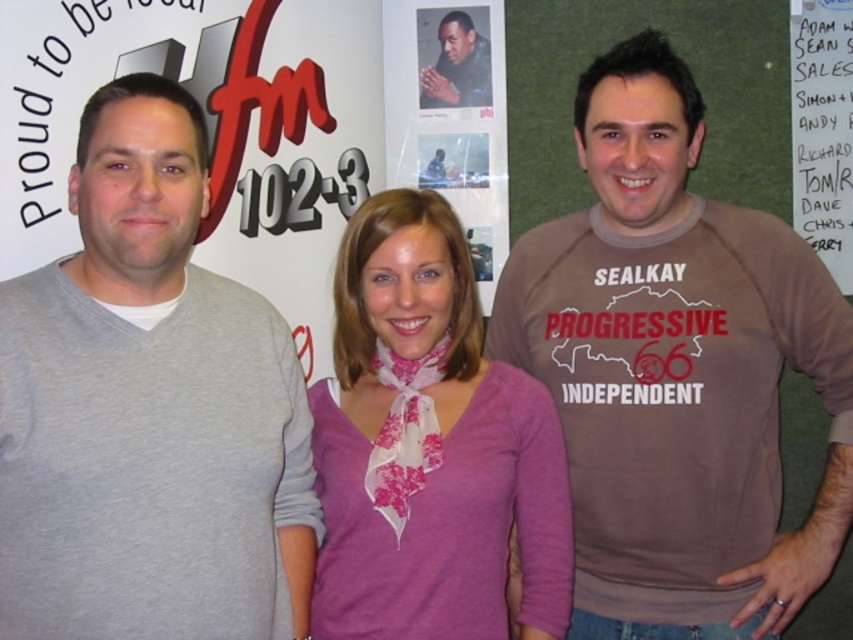
Question: From the image, what is the correct spatial relationship of pink fabric scarf at center in relation to matte black jacket at center?

Choices:
 (A) right
 (B) left

Answer: (B)

Question: Which of the following is the closest to the observer?

Choices:
 (A) (836, 3)
 (B) (589, 92)
 (C) (448, 76)

Answer: (B)

Question: In this image, where is gray cotton sweater at left located relative to pink fabric scarf at center?

Choices:
 (A) above
 (B) below

Answer: (A)

Question: Can you confirm if white paper at upper right is wider than matte black jacket at center?

Choices:
 (A) yes
 (B) no

Answer: (B)

Question: Which object is positioned farthest from the gray cotton sweater at left?

Choices:
 (A) brown cotton t-shirt at center
 (B) matte black jacket at center

Answer: (B)

Question: Which object is closer to the camera taking this photo?

Choices:
 (A) gray cotton sweater at left
 (B) pink fabric scarf at center
 (C) matte black jacket at center

Answer: (A)